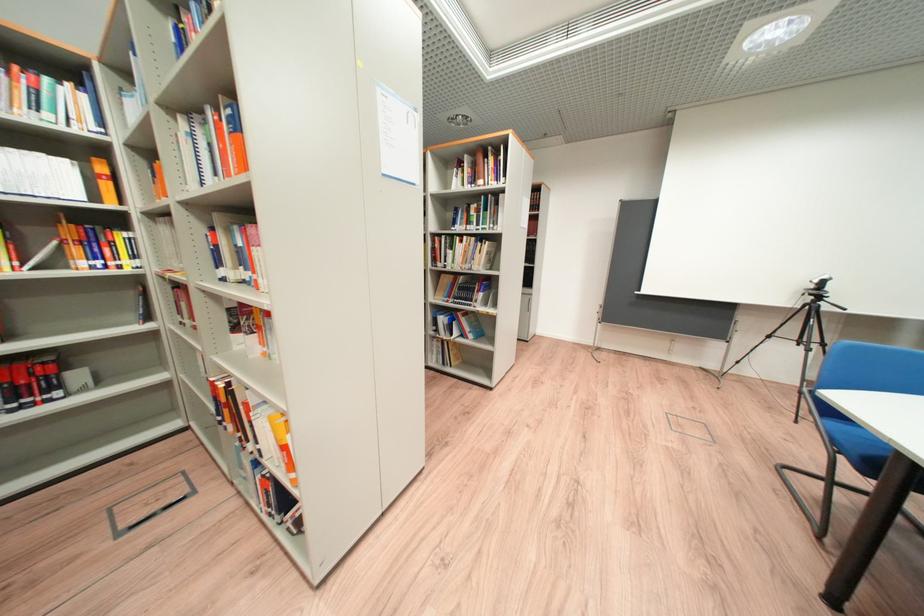
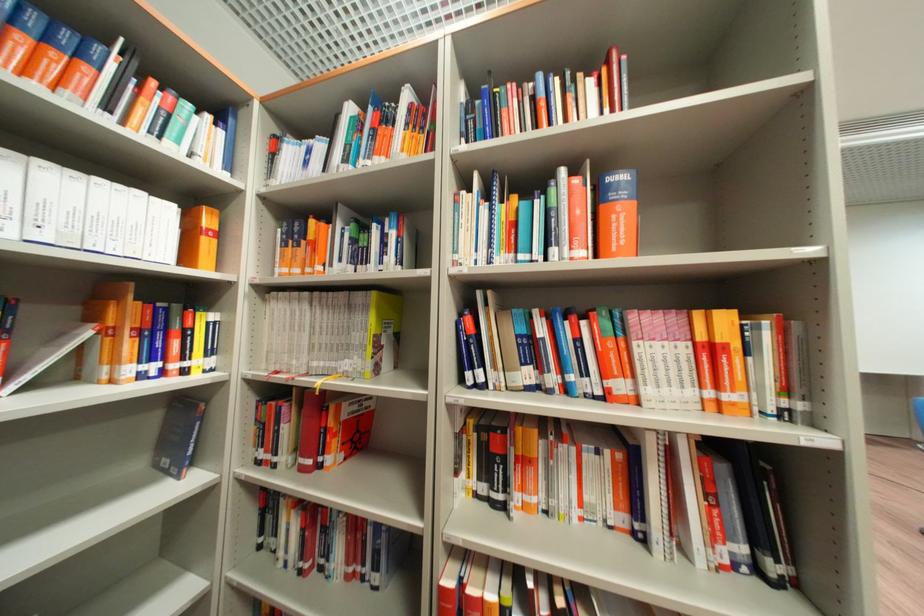
Where in the second image is the point corresponding to point (104, 198) from the first image?

(198, 260)